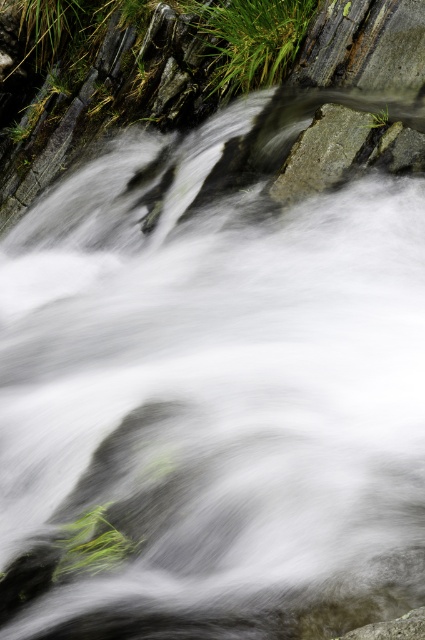
You are standing at the edge of the stream and want to place a small decorative stone between the green grass at upper center and the gray rough rock at center. According to the scene, where should you place it to ensure it is between them?

Place the small decorative stone between the green grass at upper center and the gray rough rock at center so that it is on the right side of the green grass at upper center and the left side of the gray rough rock at center.

From the picture: You are a hiker who wants to cross the stream safely. You notice the green grass at upper center and the gray rough rock at center. Which surface would be more stable to step on?

The gray rough rock at center would be more stable to step on because it is shorter than the green grass at upper center, making it a firmer surface.

You are a hiker trying to cross the stream. You need to step on the green grass at upper center and the gray rough rock at center. Which one should you choose to step on for better stability?

The gray rough rock at center is better for stability because it is smaller in size than the green grass at upper center, making it more likely to be firmly anchored in place.